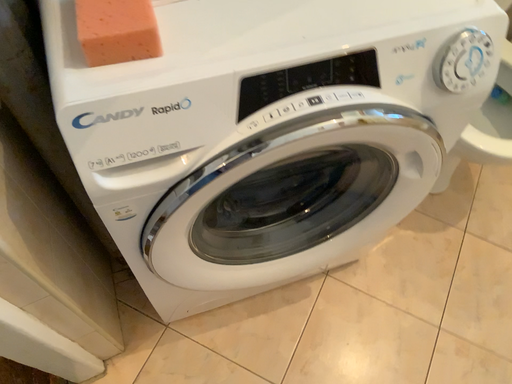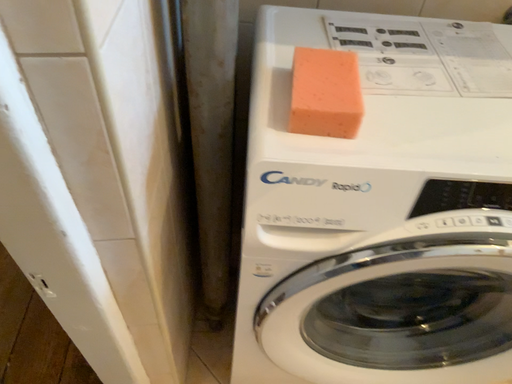
Question: How did the camera likely rotate when shooting the video?

Choices:
 (A) rotated right
 (B) rotated left

Answer: (B)